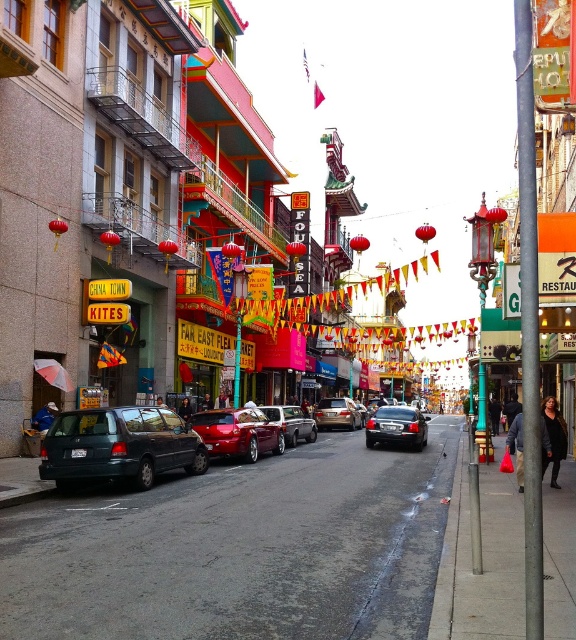
You are a delivery person who needs to park your vehicle in the parking spot located between the glossy red car at center and the black leather jacket at right. Which object should you use as a reference to ensure your vehicle is properly aligned with the parking spot?

The glossy red car at center is smaller than the black leather jacket at right, so you should use the black leather jacket at right as a reference point to ensure proper alignment with the parking spot.

You are a delivery person needing to park your vehicle in this Chinatown street. You have a truck that is 2 meters wide. There are two cars parked at the center of the street, a glossy red car at center and a shiny red car at center. Which car has a width that allows your truck to fit between them?

The glossy red car at center has a larger width than the shiny red car at center. Since the truck is 2 meters wide, you need to check the space between the two cars. However, the description only states the width comparison between the cars, not the actual space between them. Without knowing the distance between the cars, it is impossible to determine if the truck can fit.

You are a photographer standing on the sidewalk in Chinatown. You want to take a photo of the shiny red car at center without the black leather jacket at right blocking the view. Is the jacket too tall to block the car in the photo?

The black leather jacket at right has a greater height compared to the shiny red car at center, so the jacket could potentially block the view of the car in the photo if positioned between the photographer and the car.